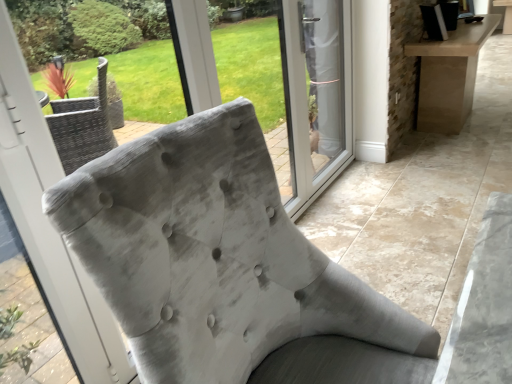
Question: Would you say velvet gray chair at center contains transparent glass door at center?

Choices:
 (A) yes
 (B) no

Answer: (B)

Question: Is velvet gray chair at center smaller than transparent glass door at center?

Choices:
 (A) no
 (B) yes

Answer: (A)

Question: Is the depth of velvet gray chair at center less than that of transparent glass door at center?

Choices:
 (A) yes
 (B) no

Answer: (A)

Question: Is velvet gray chair at center behind transparent glass door at center?

Choices:
 (A) yes
 (B) no

Answer: (B)

Question: Is velvet gray chair at center bigger than transparent glass door at center?

Choices:
 (A) yes
 (B) no

Answer: (A)

Question: Is velvet gray chair at center positioned far away from transparent glass door at center?

Choices:
 (A) no
 (B) yes

Answer: (B)

Question: Is transparent glass door at center further to the viewer compared to velvet gray chair at center?

Choices:
 (A) no
 (B) yes

Answer: (B)

Question: Is transparent glass door at center smaller than velvet gray chair at center?

Choices:
 (A) yes
 (B) no

Answer: (A)

Question: From the image's perspective, is transparent glass door at center located beneath velvet gray chair at center?

Choices:
 (A) no
 (B) yes

Answer: (A)

Question: Can you confirm if transparent glass door at center is positioned to the right of velvet gray chair at center?

Choices:
 (A) no
 (B) yes

Answer: (B)

Question: Can you confirm if transparent glass door at center is thinner than velvet gray chair at center?

Choices:
 (A) yes
 (B) no

Answer: (A)

Question: From a real-world perspective, is transparent glass door at center on velvet gray chair at center?

Choices:
 (A) no
 (B) yes

Answer: (B)

Question: Is point [253, 152] closer or farther from the camera than point [316, 89]?

Choices:
 (A) farther
 (B) closer

Answer: (B)